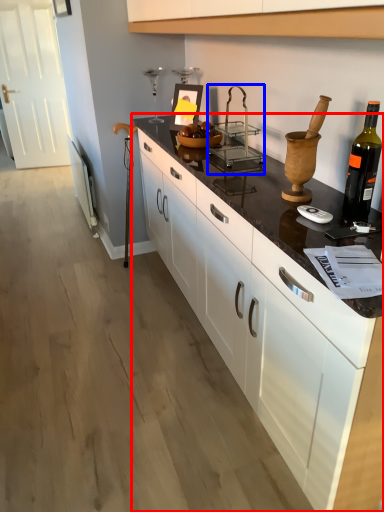
Question: Among these objects, which one is farthest to the camera, countertop (highlighted by a red box) or appliance (highlighted by a blue box)?

Choices:
 (A) countertop
 (B) appliance

Answer: (B)